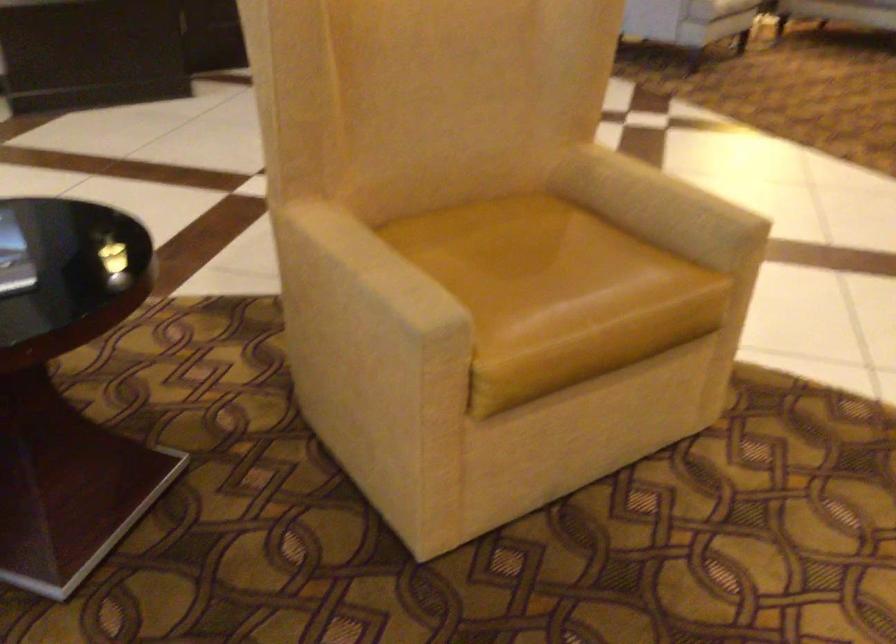
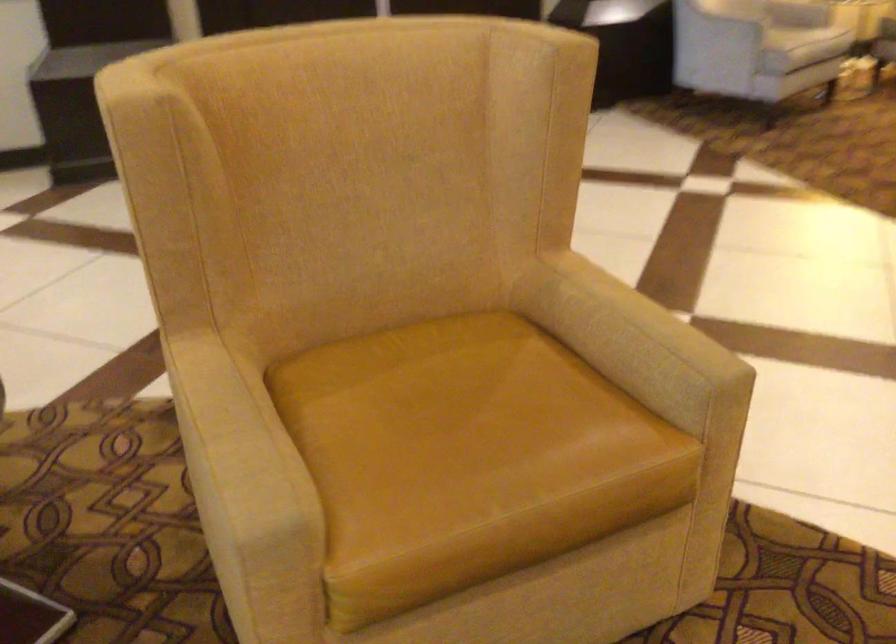
Locate, in the second image, the point that corresponds to point (531, 270) in the first image.

(452, 426)